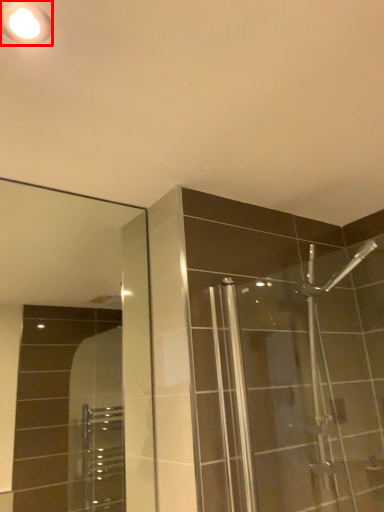
Question: From the image's perspective, considering the relative positions of light fixture (annotated by the red box) and mirror in the image provided, where is light fixture (annotated by the red box) located with respect to the staircase?

Choices:
 (A) below
 (B) above

Answer: (B)